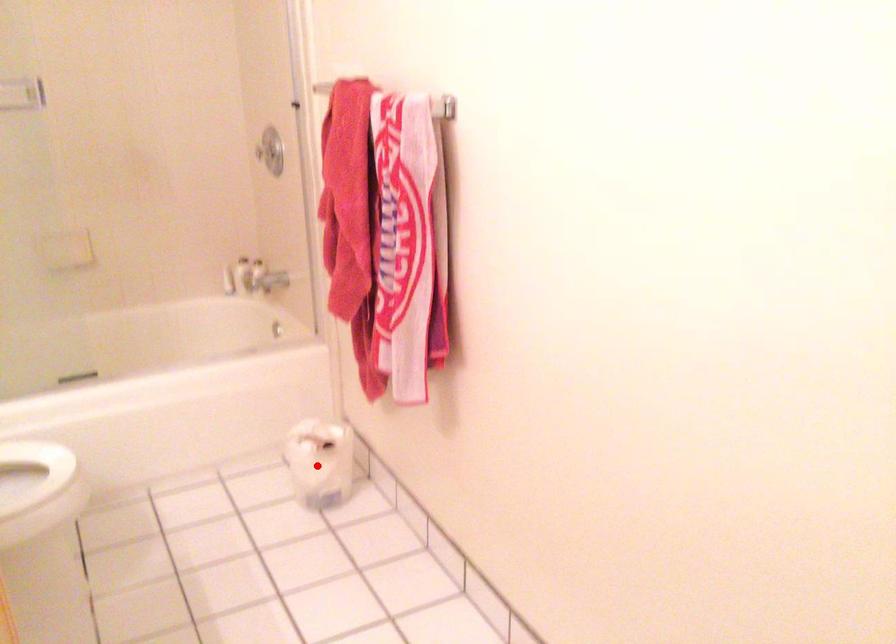
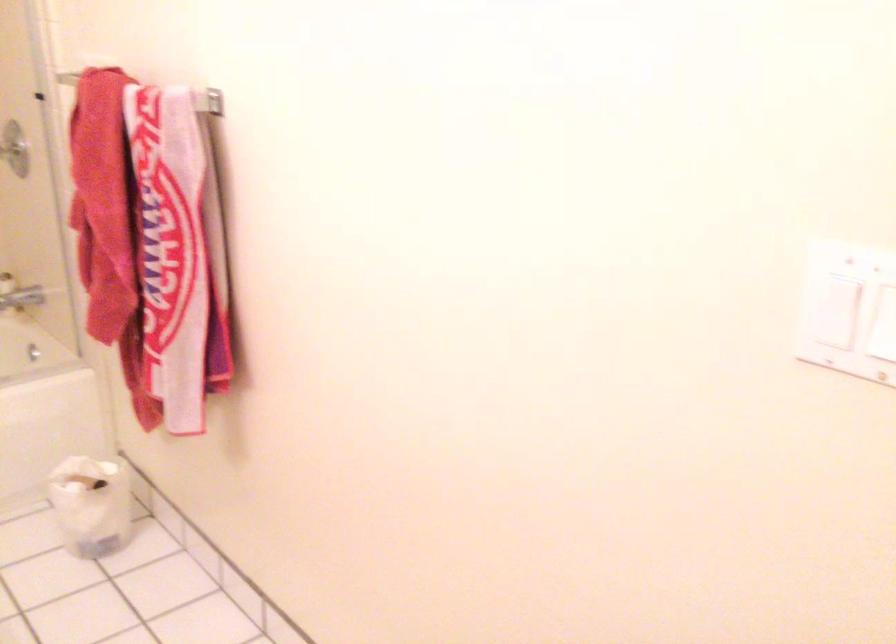
Find the pixel in the second image that matches the highlighted location in the first image.

(90, 505)